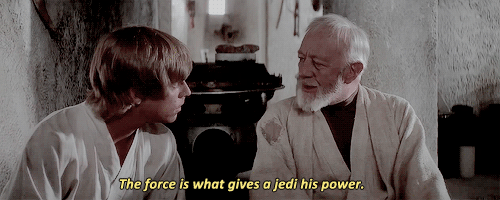
You are a GUI agent. You are given a task and a screenshot of the screen. Output one action in this format:
    pyautogui.click(x=<x>, y=<y>)
    Task: Click on the walls
    The width and height of the screenshot is (500, 200).
    Given the screenshot: What is the action you would take?
    tap(46, 45), tap(460, 48), tap(284, 36), tap(188, 23)